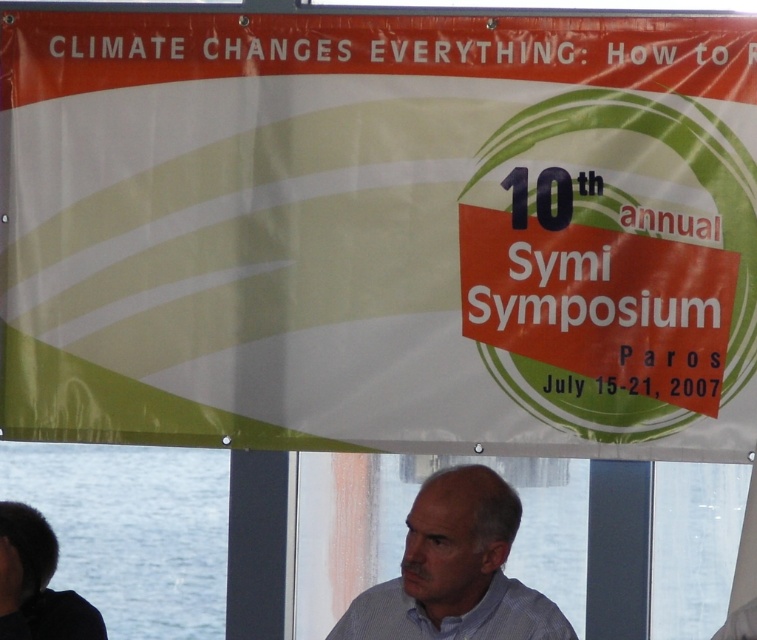
Question: Which point is closer to the camera taking this photo?

Choices:
 (A) (310, 483)
 (B) (8, 538)
 (C) (117, 605)
 (D) (17, 394)

Answer: (B)

Question: Which is farther from the white fabric banner at upper center?

Choices:
 (A) dark brown hair at lower left
 (B) blue shirt at center
 (C) blue water at lower left

Answer: (A)

Question: Is white fabric banner at upper center further to the viewer compared to blue water at lower left?

Choices:
 (A) no
 (B) yes

Answer: (A)

Question: Can you confirm if white fabric banner at upper center is thinner than dark brown hair at lower left?

Choices:
 (A) yes
 (B) no

Answer: (B)

Question: Where is white fabric banner at upper center located in relation to blue water at lower left in the image?

Choices:
 (A) below
 (B) above

Answer: (B)

Question: Estimate the real-world distances between objects in this image. Which object is farther from the dark brown hair at lower left?

Choices:
 (A) white fabric banner at upper center
 (B) blue shirt at center

Answer: (B)